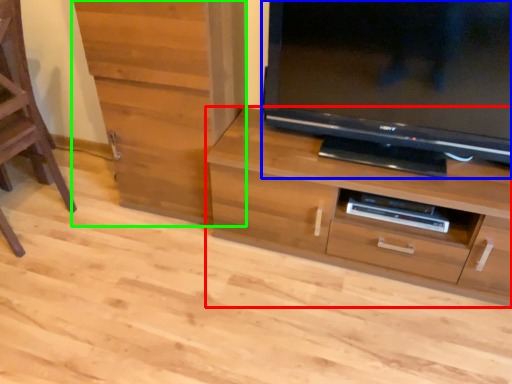
Question: Estimate the real-world distances between objects in this image. Which object is farther from chest of drawers (highlighted by a red box), television (highlighted by a blue box) or cabinetry (highlighted by a green box)?

Choices:
 (A) television
 (B) cabinetry

Answer: (B)